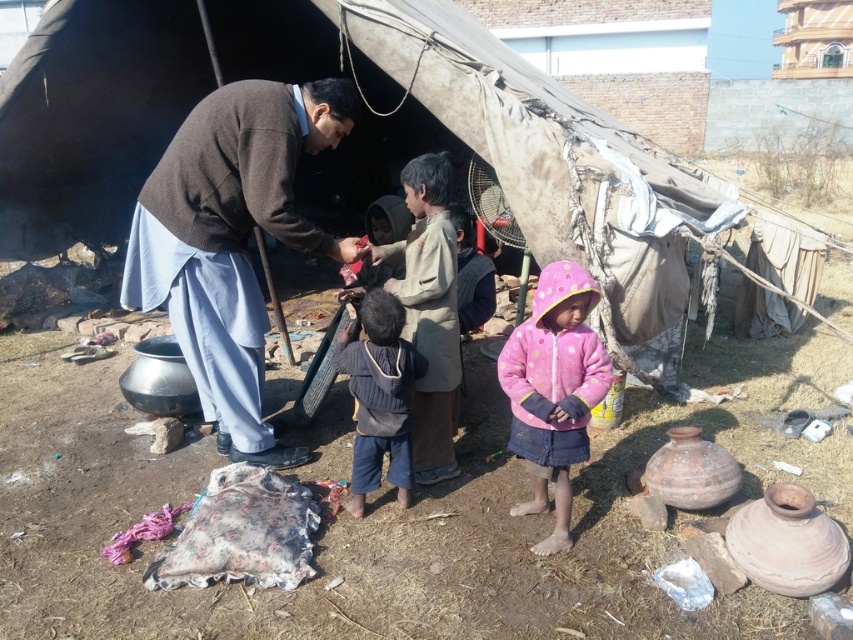
Which of these two, rough canvas tent at center or pink fleece jacket at lower right, stands shorter?

rough canvas tent at center

Who is positioned more to the right, rough canvas tent at center or pink fleece jacket at lower right?

Positioned to the right is pink fleece jacket at lower right.

Which is in front, point (631, 243) or point (531, 408)?

Positioned in front is point (531, 408).

You are a GUI agent. You are given a task and a screenshot of the screen. Output one action in this format:
    pyautogui.click(x=<x>, y=<y>)
    Task: Click on the rough canvas tent at center
    This screenshot has width=853, height=640.
    Given the screenshot: What is the action you would take?
    pyautogui.click(x=503, y=147)

Which is behind, point (198, 19) or point (381, 320)?

The point (198, 19) is behind.

Is rough canvas tent at center to the right of dark blue knitted sweater at center from the viewer's perspective?

Yes, rough canvas tent at center is to the right of dark blue knitted sweater at center.

The image size is (853, 640). What are the coordinates of `rough canvas tent at center` in the screenshot? It's located at (503, 147).

You are a GUI agent. You are given a task and a screenshot of the screen. Output one action in this format:
    pyautogui.click(x=<x>, y=<y>)
    Task: Click on the rough canvas tent at center
    
    Given the screenshot: What is the action you would take?
    pyautogui.click(x=503, y=147)

Can you confirm if rough canvas tent at center is smaller than brown wool sweater at center?

Yes, rough canvas tent at center is smaller than brown wool sweater at center.

Consider the image. Is rough canvas tent at center positioned before brown wool sweater at center?

That is False.

Is point (659, 364) farther from viewer compared to point (221, 314)?

Yes.

In order to click on rough canvas tent at center in this screenshot , I will do `click(503, 147)`.